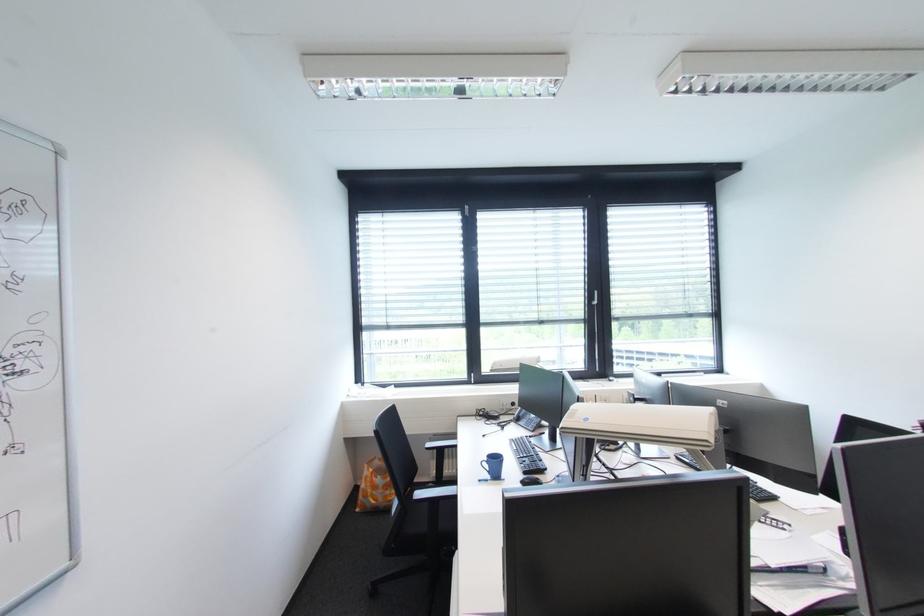
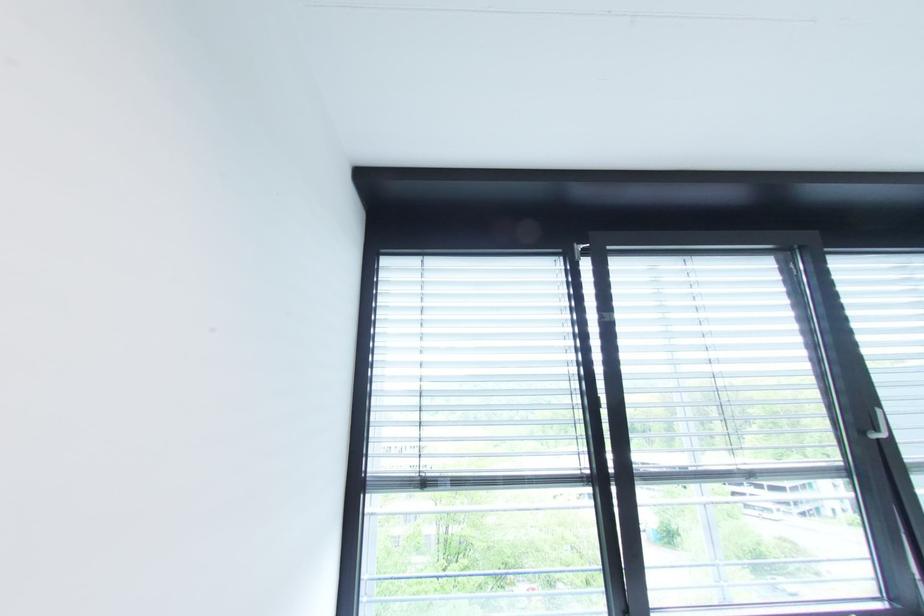
Where in the second image is the point corresponding to point (602, 304) from the first image?

(889, 437)